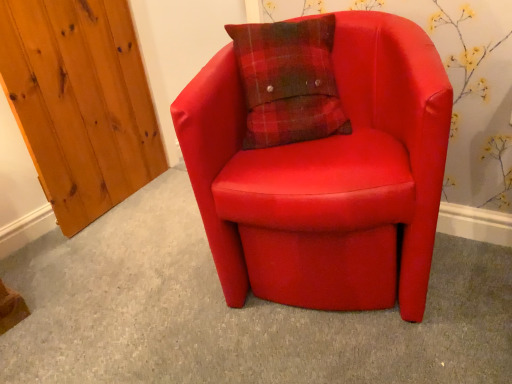
At what (x,y) coordinates should I click in order to perform the action: click on matte red armchair at center. Please return your answer as a coordinate pair (x, y). Image resolution: width=512 pixels, height=384 pixels. Looking at the image, I should click on pos(327,177).

Describe the element at coordinates (327, 177) in the screenshot. I see `matte red armchair at center` at that location.

Identify the location of matte red armchair at center. The image size is (512, 384). (327, 177).